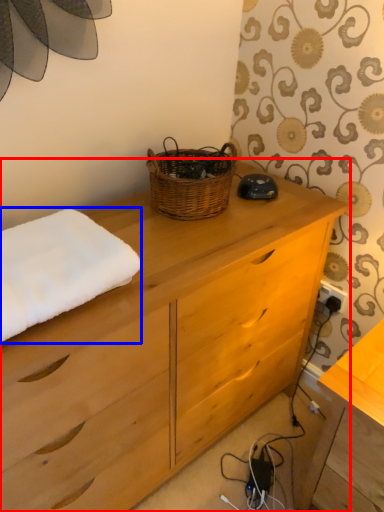
Question: Which point is further to the camera, chest of drawers (highlighted by a red box) or bath towel (highlighted by a blue box)?

Choices:
 (A) chest of drawers
 (B) bath towel

Answer: (B)